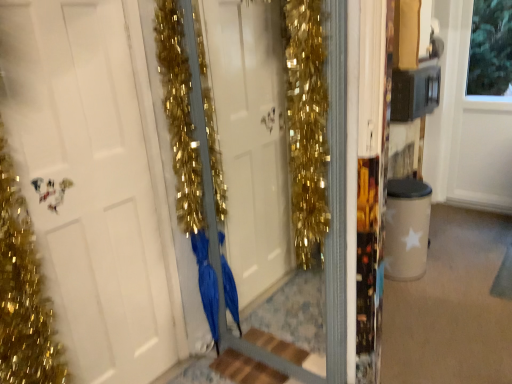
The width and height of the screenshot is (512, 384). Find the location of `blue satin dress at center`. blue satin dress at center is located at coordinates (206, 282).

What are the coordinates of `blue satin dress at center` in the screenshot? It's located at tap(206, 282).

Is blue satin dress at center oriented towards wooden at center?

No, blue satin dress at center is not oriented towards wooden at center.

Looking at this image, is blue satin dress at center spatially inside wooden at center, or outside of it?

blue satin dress at center is outside wooden at center.

Does blue satin dress at center have a greater width compared to wooden at center?

Incorrect, the width of blue satin dress at center does not surpass that of wooden at center.

Is blue satin dress at center next to wooden at center?

No, blue satin dress at center is not in contact with wooden at center.

Identify the location of door above the blue satin dress at center (from the image's perspective). (94, 182).

Who is bigger, blue satin dress at center or white matte door at center?

white matte door at center is bigger.

How far apart are blue satin dress at center and white matte door at center?

blue satin dress at center and white matte door at center are 53.57 centimeters apart.

Are white matte door at center and wooden at center far apart?

No.

Which is behind, white matte door at center or wooden at center?

wooden at center.

This screenshot has height=384, width=512. I want to click on stair that appears below the white matte door at center (from the image's perspective), so click(x=245, y=369).

How many degrees apart are the facing directions of white matte door at center and wooden at center?

white matte door at center and wooden at center are facing 90.3 degrees away from each other.

Is white matte door at center turned away from blue satin dress at center?

No.

I want to click on dress behind the white matte door at center, so click(x=206, y=282).

Based on their sizes in the image, would you say white matte door at center is bigger or smaller than blue satin dress at center?

In the image, white matte door at center appears to be larger than blue satin dress at center.

Does white matte door at center appear on the right side of blue satin dress at center?

No.

Measure the distance between wooden at center and blue satin dress at center.

wooden at center and blue satin dress at center are 30.02 centimeters apart from each other.

From the picture: Would you consider wooden at center to be distant from blue satin dress at center?

No.

Is wooden at center situated inside blue satin dress at center or outside?

wooden at center is not enclosed by blue satin dress at center.

Looking at this image, considering the positions of objects wooden at center and blue satin dress at center in the image provided, who is more to the right, wooden at center or blue satin dress at center?

Positioned to the right is wooden at center.

In the image, is wooden at center positioned in front of or behind white matte door at center?

Clearly, wooden at center is behind white matte door at center.

Is wooden at center taller or shorter than white matte door at center?

Considering their sizes, wooden at center has less height than white matte door at center.

I want to click on stair behind the white matte door at center, so click(245, 369).

Considering the relative positions of wooden at center and white matte door at center in the image provided, is wooden at center to the left or to the right of white matte door at center?

From the image, it's evident that wooden at center is to the right of white matte door at center.

The image size is (512, 384). I want to click on stair below the blue satin dress at center (from the image's perspective), so click(245, 369).

There is a blue satin dress at center. Identify the location of door above it (from a real-world perspective). The height and width of the screenshot is (384, 512). (94, 182).

Estimate the real-world distances between objects in this image. Which object is closer to wooden at center, white matte door at center or blue satin dress at center?

blue satin dress at center.

Considering their positions, is blue satin dress at center positioned further to white matte door at center than wooden at center?

Among the two, wooden at center is located further to white matte door at center.

Considering their positions, is white matte door at center positioned closer to blue satin dress at center than wooden at center?

wooden at center is positioned closer to the anchor blue satin dress at center.

From the image, which object appears to be nearer to wooden at center, blue satin dress at center or white matte door at center?

The object closer to wooden at center is blue satin dress at center.

Which object lies further to the anchor point blue satin dress at center, wooden at center or white matte door at center?

Among the two, white matte door at center is located further to blue satin dress at center.

Based on their spatial positions, is wooden at center or blue satin dress at center further from white matte door at center?

wooden at center lies further to white matte door at center than the other object.

You are a GUI agent. You are given a task and a screenshot of the screen. Output one action in this format:
    pyautogui.click(x=<x>, y=<y>)
    Task: Click on the stair between white matte door at center and blue satin dress at center from front to back
    Image resolution: width=512 pixels, height=384 pixels.
    Given the screenshot: What is the action you would take?
    pyautogui.click(x=245, y=369)